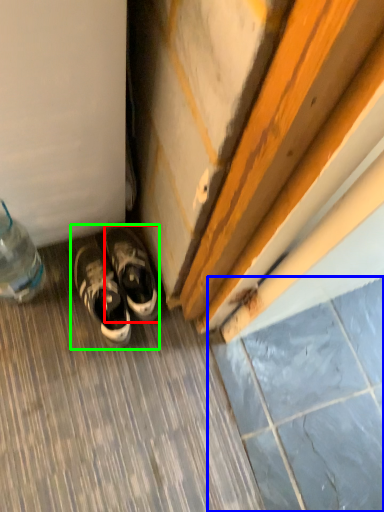
Question: Which object is positioned farthest from sneakers (highlighted by a red box)? Select from tile (highlighted by a blue box) and footwear (highlighted by a green box).

Choices:
 (A) tile
 (B) footwear

Answer: (A)